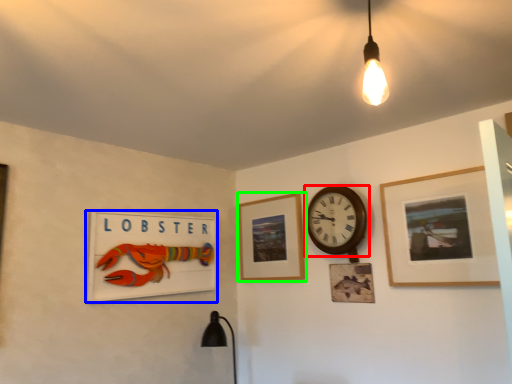
Question: Which is nearer to the wall clock (highlighted by a red box)? picture frame (highlighted by a blue box) or picture frame (highlighted by a green box).

Choices:
 (A) picture frame
 (B) picture frame

Answer: (B)